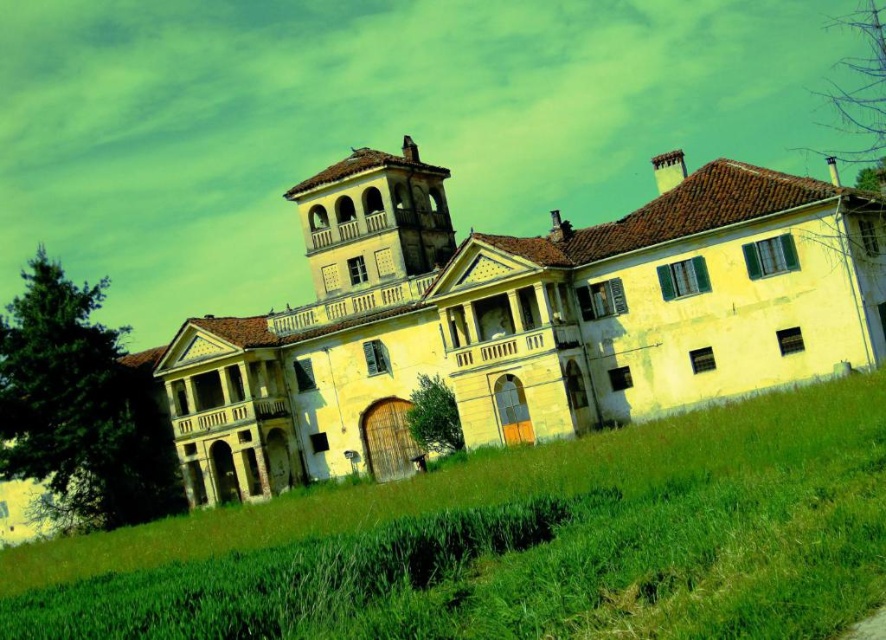
Question: Can you confirm if yellow matte building at center is thinner than green grassy field at lower center?

Choices:
 (A) yes
 (B) no

Answer: (B)

Question: Is yellow matte building at center thinner than green grassy field at lower center?

Choices:
 (A) yes
 (B) no

Answer: (B)

Question: From the image, what is the correct spatial relationship of yellow matte building at center in relation to green grassy field at lower center?

Choices:
 (A) left
 (B) right

Answer: (B)

Question: Which point is farther to the camera?

Choices:
 (A) (867, 378)
 (B) (459, 410)

Answer: (B)

Question: Which point is closer to the camera?

Choices:
 (A) (x=701, y=534)
 (B) (x=859, y=202)

Answer: (A)